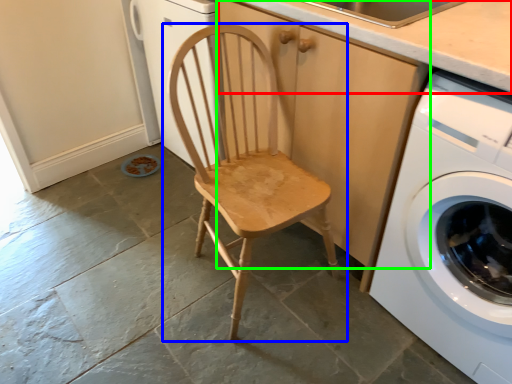
Question: Estimate the real-world distances between objects in this image. Which object is closer to counter top (highlighted by a red box), chair (highlighted by a blue box) or cabinetry (highlighted by a green box)?

Choices:
 (A) chair
 (B) cabinetry

Answer: (B)